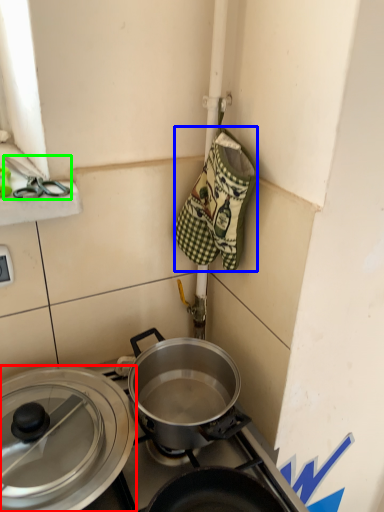
Question: Which object is the farthest from pot/pan (highlighted by a red box)? Choose among these: material (highlighted by a blue box) or scissors (highlighted by a green box).

Choices:
 (A) material
 (B) scissors

Answer: (B)